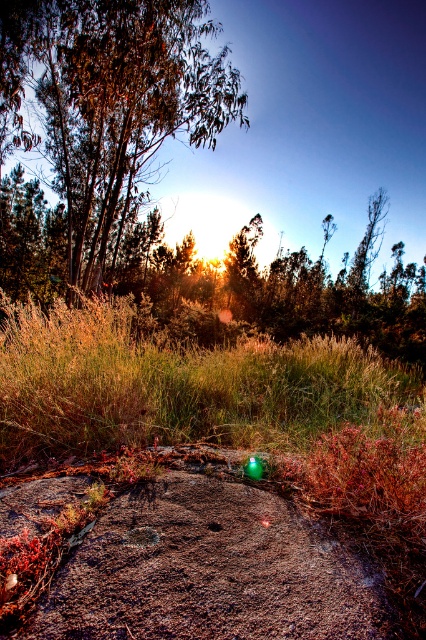
Question: Does green leafy tree at upper left have a greater width compared to golden grass at center?

Choices:
 (A) yes
 (B) no

Answer: (A)

Question: Which object is farther from the camera taking this photo?

Choices:
 (A) golden grass at center
 (B) green leafy tree at upper left

Answer: (B)

Question: Which of the following is the closest to the observer?

Choices:
 (A) green leafy tree at upper left
 (B) golden grass at center

Answer: (B)

Question: Among these objects, which one is nearest to the camera?

Choices:
 (A) green leafy tree at upper left
 (B) golden grass at center

Answer: (B)

Question: Is green leafy tree at upper left thinner than golden grass at center?

Choices:
 (A) no
 (B) yes

Answer: (A)

Question: Does green leafy tree at upper left come behind golden grass at center?

Choices:
 (A) yes
 (B) no

Answer: (A)